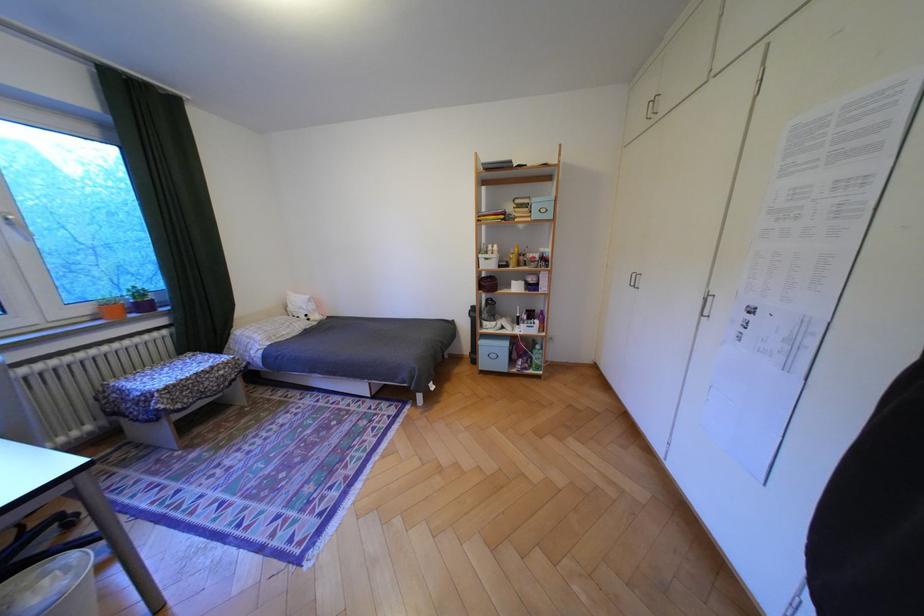
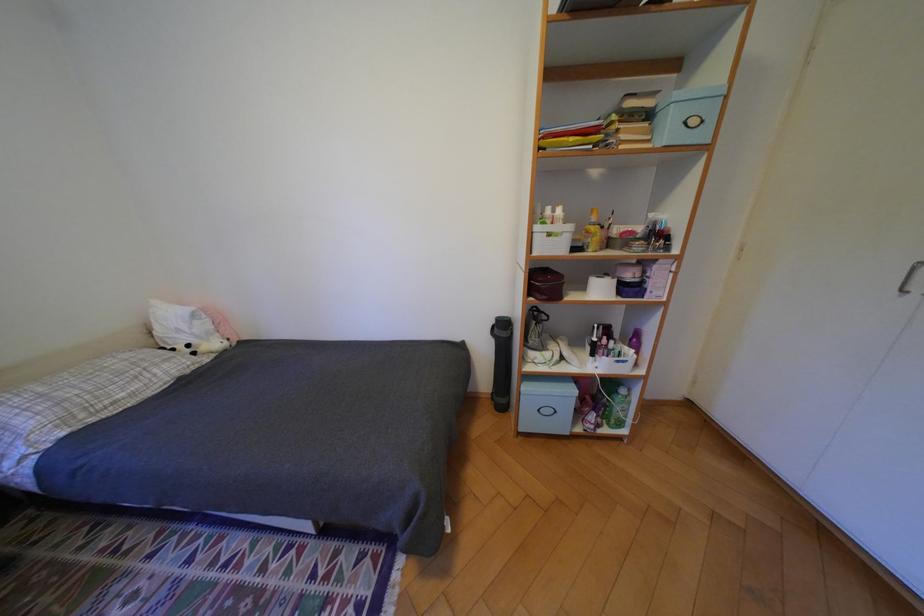
Question: In a continuous first-person perspective shot, in which direction is the camera moving?

Choices:
 (A) Left
 (B) Right
 (C) Forward
 (D) Backward

Answer: (C)